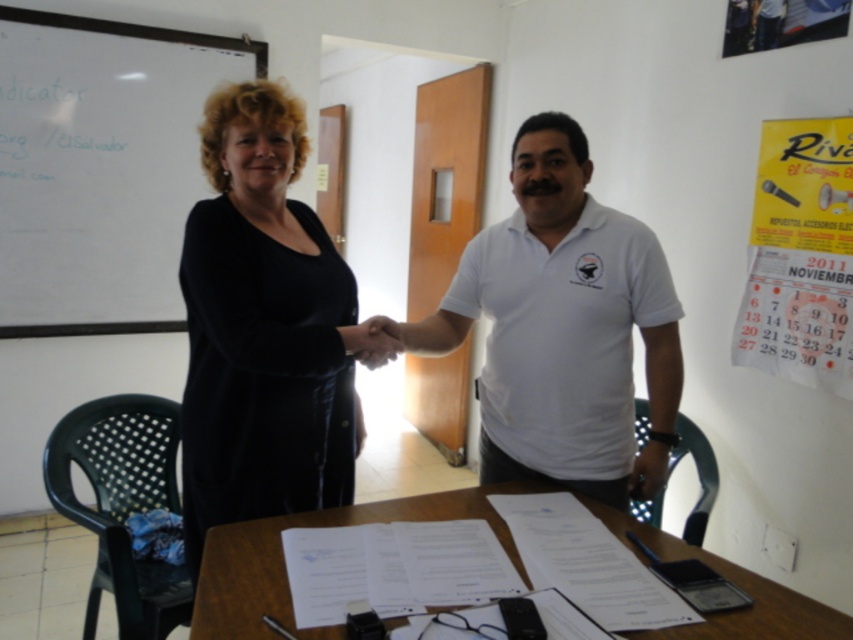
Please look at the scene where two people are shaking hands in a meeting room. There is a yellow paper calendar at upper right located at point (x=799, y=257). What is the coordinate of the yellow paper calendar at upper right?

The yellow paper calendar at upper right is located at point (x=799, y=257).

You are an office assistant who needs to locate the white cotton shirt at center and the whiteboard at upper left in the meeting room. According to the scene, which object is positioned to the right of the other?

The white cotton shirt at center is positioned to the right of the whiteboard at upper left.